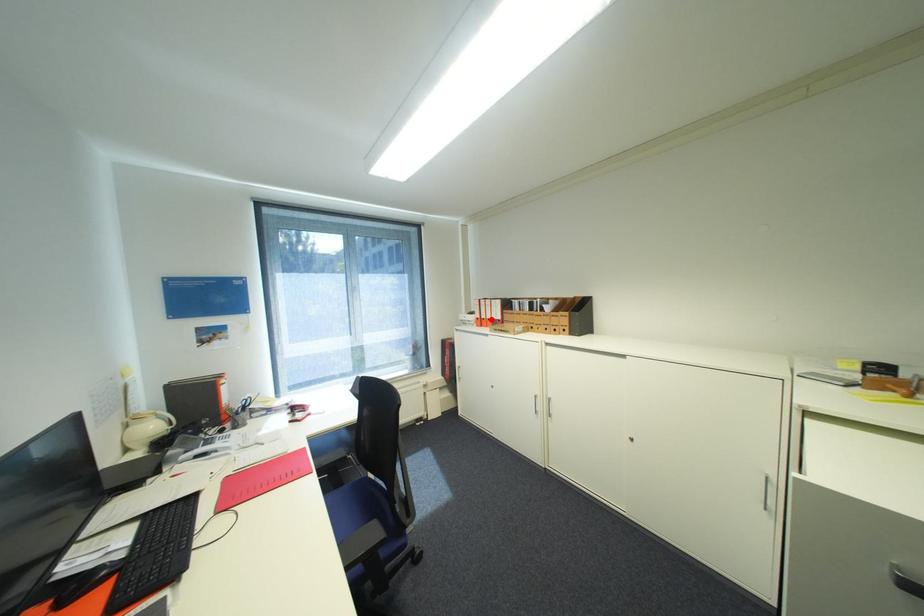
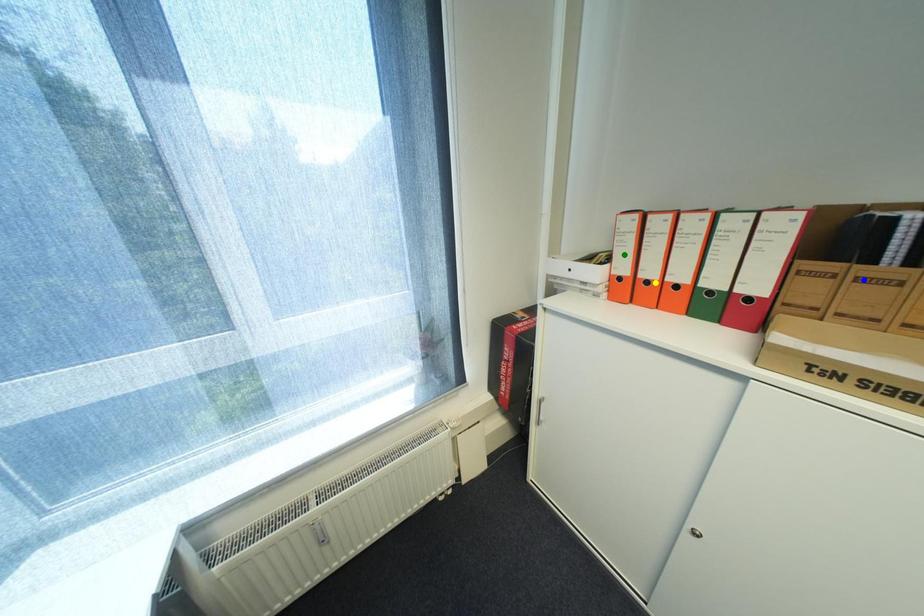
Question: I am providing you with two images of the same scene from different viewpoints. A red point is marked on the first image. You are given multiple points on the second image. Which point in image 2 represents the same 3d spot as the red point in image 1?

Choices:
 (A) yellow point
 (B) green point
 (C) blue point

Answer: (A)